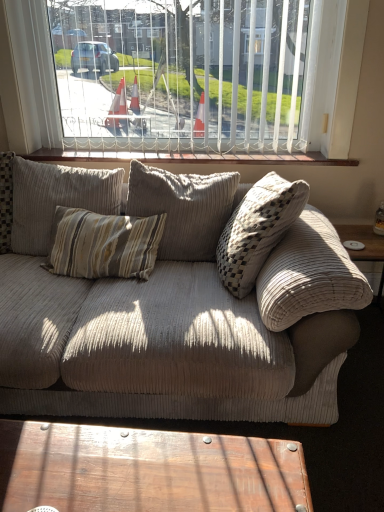
Question: Is wooden polished coffee table at lower center turned away from corduroy pillow at center, the first pillow positioned from the right?

Choices:
 (A) no
 (B) yes

Answer: (B)

Question: Can you confirm if wooden polished coffee table at lower center is taller than corduroy pillow at center, marked as the 2th pillow in a left-to-right arrangement?

Choices:
 (A) yes
 (B) no

Answer: (B)

Question: Is wooden polished coffee table at lower center positioned in front of corduroy pillow at center, the first pillow positioned from the right?

Choices:
 (A) yes
 (B) no

Answer: (A)

Question: Considering the relative sizes of wooden polished coffee table at lower center and corduroy pillow at center, the first pillow positioned from the right, in the image provided, is wooden polished coffee table at lower center bigger than corduroy pillow at center, the first pillow positioned from the right,?

Choices:
 (A) no
 (B) yes

Answer: (A)

Question: Does wooden polished coffee table at lower center appear on the left side of corduroy pillow at center, marked as the 2th pillow in a left-to-right arrangement?

Choices:
 (A) no
 (B) yes

Answer: (B)

Question: Is point (221, 492) positioned closer to the camera than point (190, 153)?

Choices:
 (A) closer
 (B) farther

Answer: (A)

Question: Considering the positions of wooden polished coffee table at lower center and wooden at upper center in the image, is wooden polished coffee table at lower center taller or shorter than wooden at upper center?

Choices:
 (A) tall
 (B) short

Answer: (A)

Question: Would you say wooden polished coffee table at lower center is to the left or to the right of wooden at upper center in the picture?

Choices:
 (A) right
 (B) left

Answer: (B)

Question: Is wooden polished coffee table at lower center in front of or behind wooden at upper center in the image?

Choices:
 (A) behind
 (B) front

Answer: (B)

Question: From a real-world perspective, is beige corduroy couch at center physically located above or below corduroy pillow at center, marked as the 2th pillow in a left-to-right arrangement?

Choices:
 (A) below
 (B) above

Answer: (A)

Question: Is beige corduroy couch at center in front of or behind corduroy pillow at center, marked as the 2th pillow in a left-to-right arrangement, in the image?

Choices:
 (A) behind
 (B) front

Answer: (B)

Question: In terms of size, does beige corduroy couch at center appear bigger or smaller than corduroy pillow at center, the first pillow positioned from the right?

Choices:
 (A) small
 (B) big

Answer: (B)

Question: From the image's perspective, is beige corduroy couch at center located above or below corduroy pillow at center, the first pillow positioned from the right?

Choices:
 (A) above
 (B) below

Answer: (B)

Question: Is white vertical blinds at upper center in front of or behind wooden polished coffee table at lower center in the image?

Choices:
 (A) front
 (B) behind

Answer: (B)

Question: In terms of width, does white vertical blinds at upper center look wider or thinner when compared to wooden polished coffee table at lower center?

Choices:
 (A) wide
 (B) thin

Answer: (B)